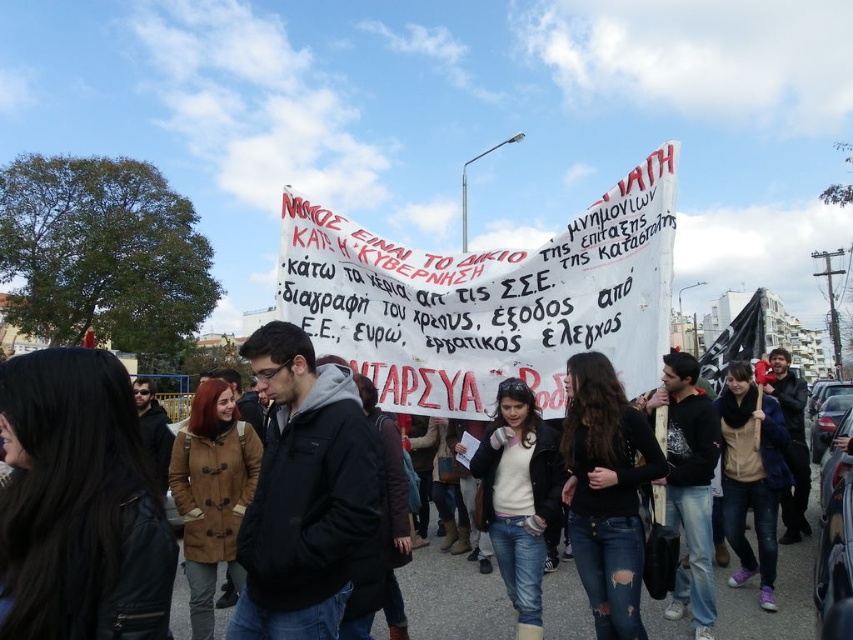
Is white paper banner at center positioned behind jeans at center?

Yes, it is.

Which is above, white paper banner at center or jeans at center?

Positioned higher is white paper banner at center.

Is point (570, 328) in front of point (810, 547)?

Yes, it is.

I want to click on white paper banner at center, so click(486, 300).